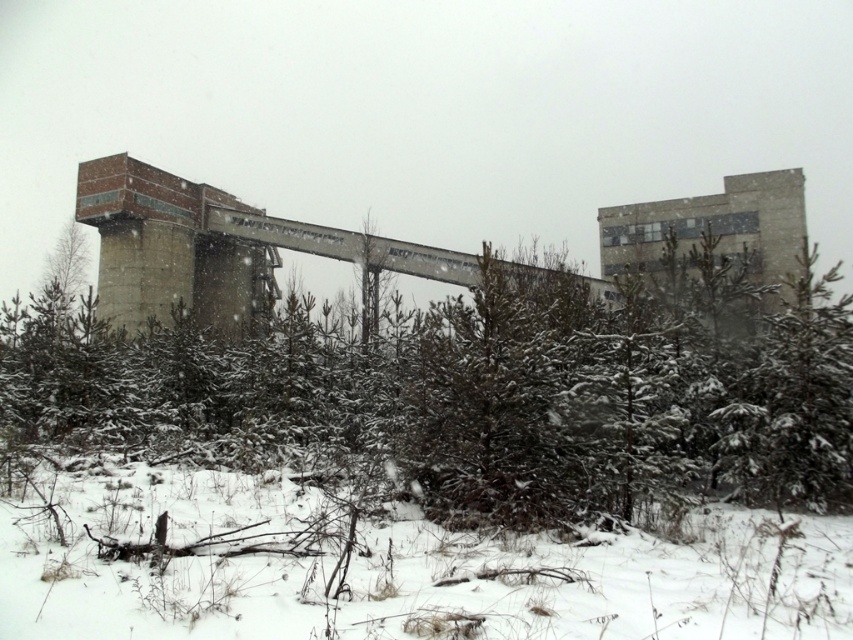
Question: Is white fluffy snow at lower center smaller than green matte tree at center-right?

Choices:
 (A) no
 (B) yes

Answer: (B)

Question: Which object is closer to the camera taking this photo?

Choices:
 (A) white fluffy snow at lower center
 (B) green matte tree at center-right

Answer: (A)

Question: Which object appears closest to the camera in this image?

Choices:
 (A) green matte tree at center-right
 (B) white fluffy snow at lower center

Answer: (B)

Question: Does white fluffy snow at lower center have a lesser width compared to green matte tree at center-right?

Choices:
 (A) yes
 (B) no

Answer: (A)

Question: Is white fluffy snow at lower center further to the viewer compared to green matte tree at center-right?

Choices:
 (A) no
 (B) yes

Answer: (A)